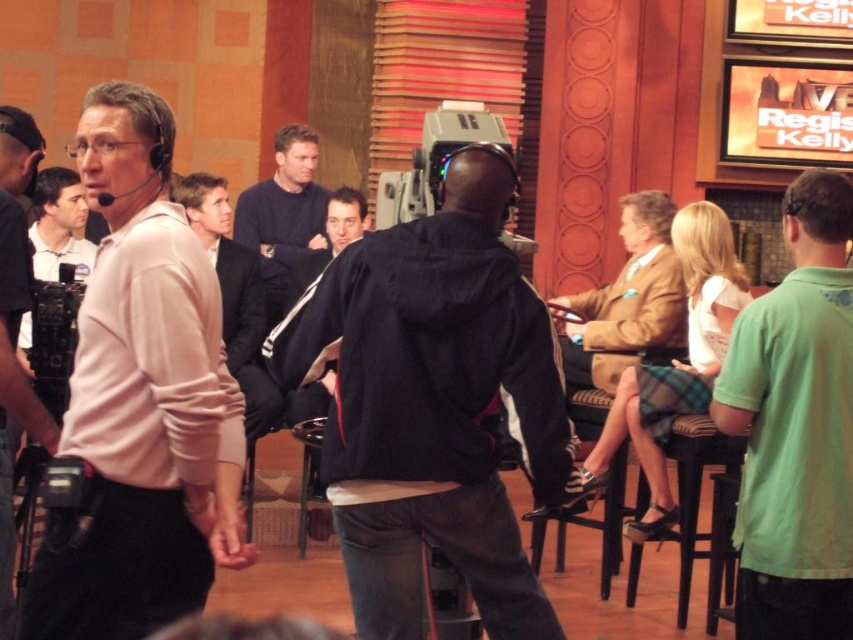
Is point (769, 632) positioned after point (227, 237)?

No, (769, 632) is closer to viewer.

Does green cotton shirt at right appear under matte pink shirt at left?

Yes.

The image size is (853, 640). Describe the element at coordinates (795, 426) in the screenshot. I see `green cotton shirt at right` at that location.

Locate an element on the screen. The width and height of the screenshot is (853, 640). green cotton shirt at right is located at coordinates click(795, 426).

The width and height of the screenshot is (853, 640). What do you see at coordinates (140, 401) in the screenshot?
I see `pink matte shirt at left` at bounding box center [140, 401].

Does pink matte shirt at left have a greater height compared to brown leather jacket at center?

Yes, pink matte shirt at left is taller than brown leather jacket at center.

What do you see at coordinates (140, 401) in the screenshot? Image resolution: width=853 pixels, height=640 pixels. I see `pink matte shirt at left` at bounding box center [140, 401].

This screenshot has height=640, width=853. Identify the location of pink matte shirt at left. (140, 401).

Which is more to the right, brown leather jacket at center or dark blue suit at center?

Positioned to the right is brown leather jacket at center.

Is brown leather jacket at center closer to camera compared to dark blue suit at center?

No, brown leather jacket at center is further to the viewer.

Describe the element at coordinates (627, 301) in the screenshot. I see `brown leather jacket at center` at that location.

Find the location of a particular element. This screenshot has height=640, width=853. brown leather jacket at center is located at coordinates (627, 301).